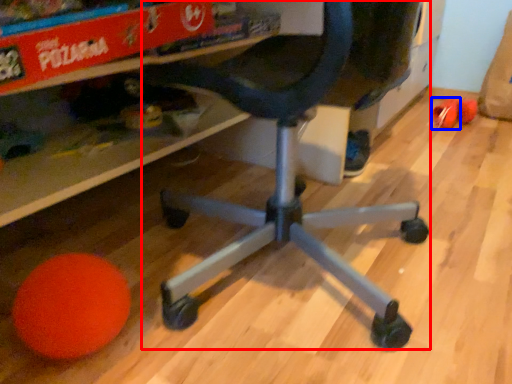
Question: Among these objects, which one is nearest to the camera, computer chair (highlighted by a red box) or toy (highlighted by a blue box)?

Choices:
 (A) computer chair
 (B) toy

Answer: (A)